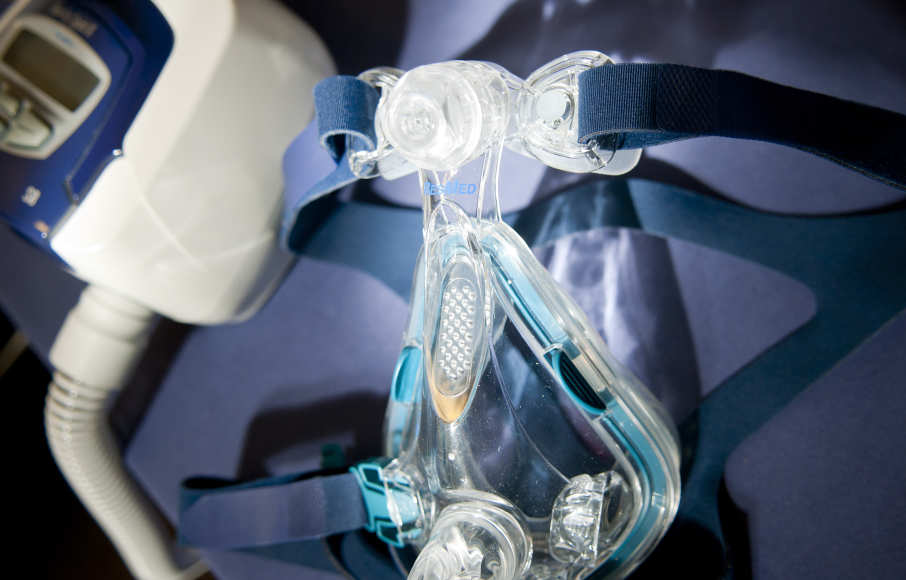
I want to click on digital display, so click(58, 84).